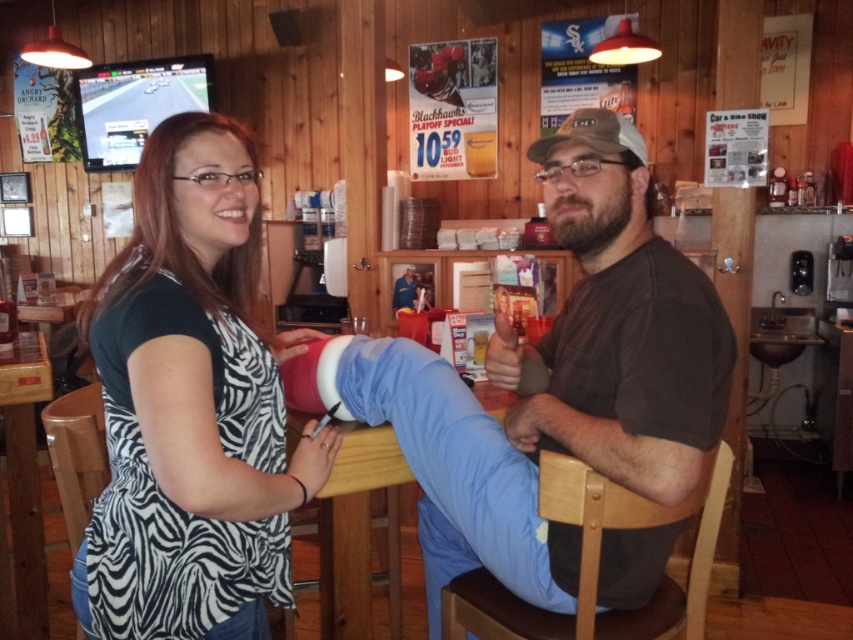
Is zebra print shirt at left taller than brown cotton shirt at center?

Incorrect, zebra print shirt at left's height is not larger of brown cotton shirt at center's.

Does zebra print shirt at left come behind brown cotton shirt at center?

No, it is in front of brown cotton shirt at center.

Between point (97, 588) and point (674, 532), which one is positioned behind?

Point (674, 532)

Find the location of `zebra print shirt at left`. zebra print shirt at left is located at coordinates (190, 404).